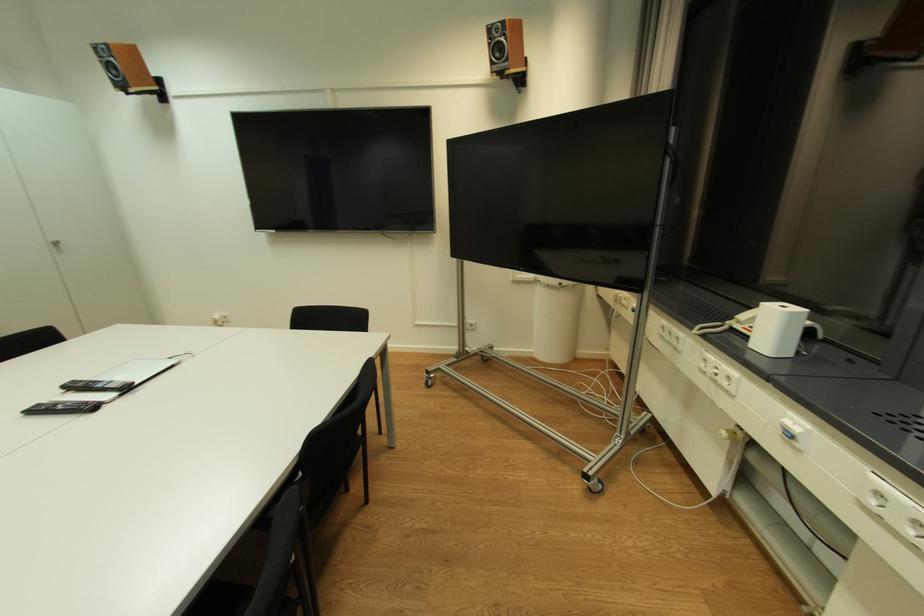
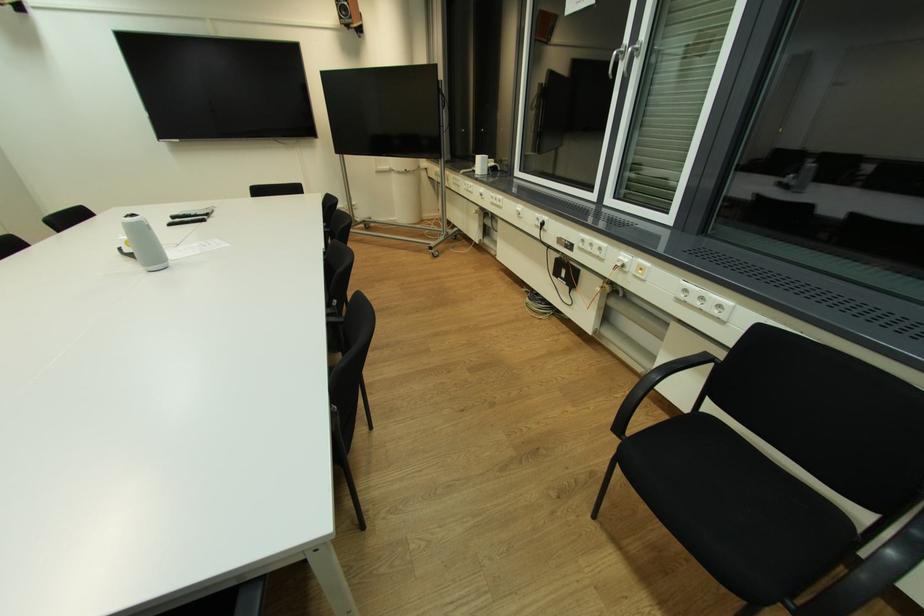
The point at (505, 55) is marked in the first image. Where is the corresponding point in the second image?

(349, 15)